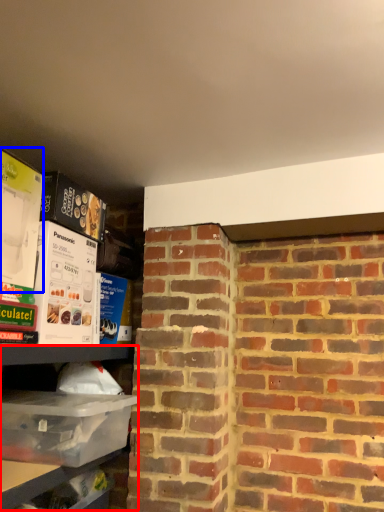
Question: Which point is closer to the camera, shelf (highlighted by a red box) or box (highlighted by a blue box)?

Choices:
 (A) shelf
 (B) box

Answer: (A)